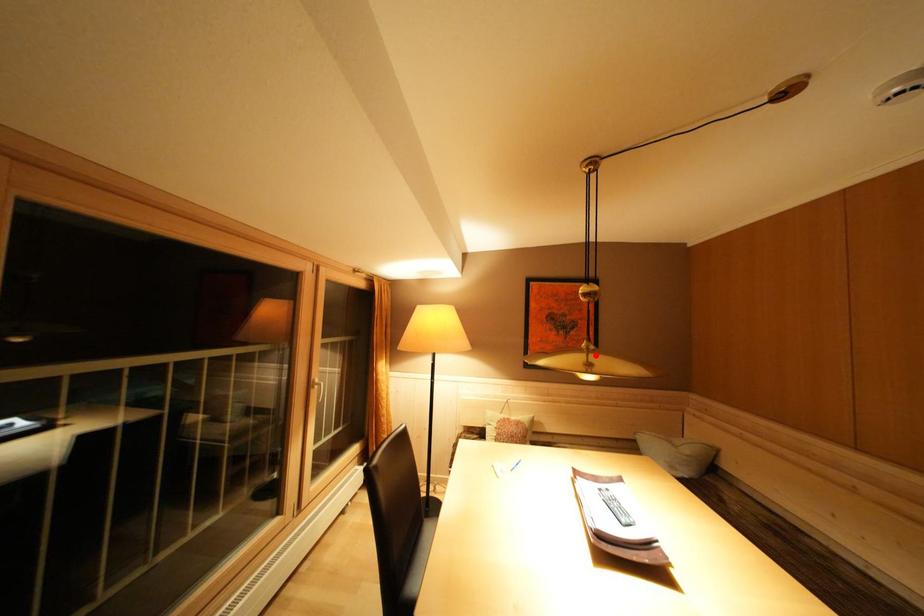
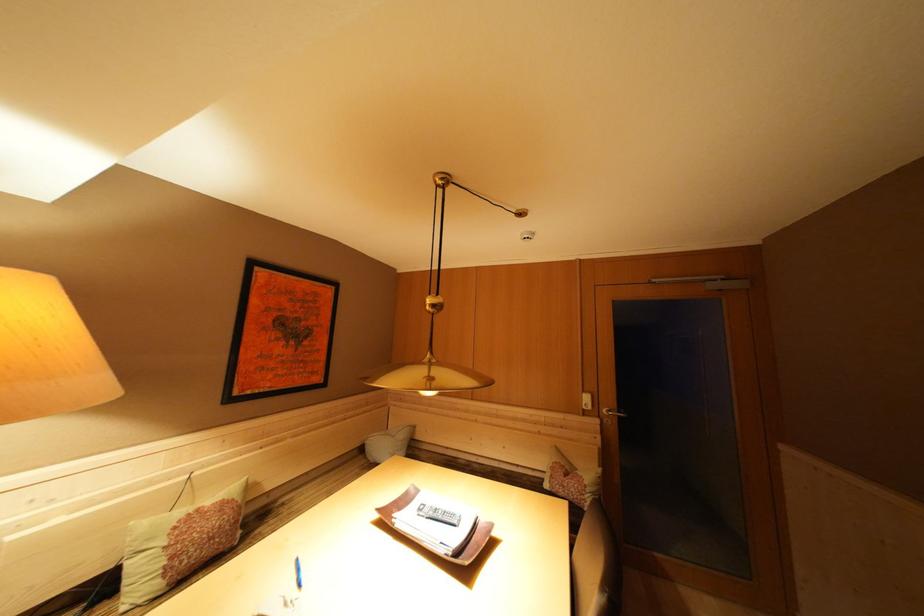
In the second image, find the point that corresponds to the highlighted location in the first image.

(438, 369)